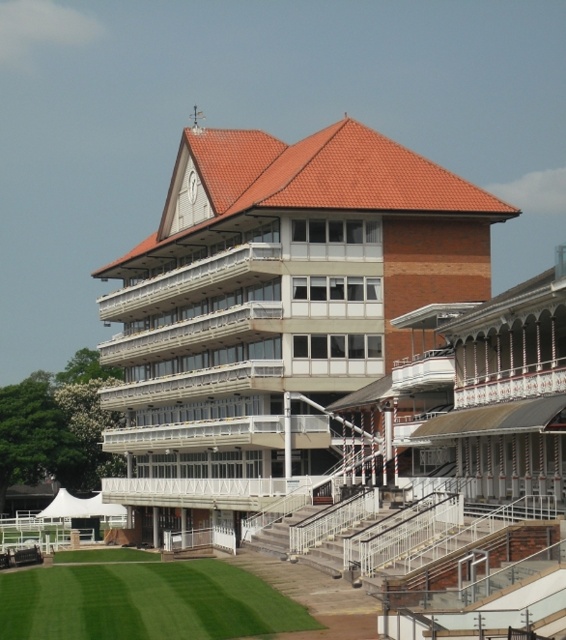
Question: Which object is closer to the camera taking this photo?

Choices:
 (A) brown brick building at center
 (B) green grass at lower left

Answer: (B)

Question: Which of the following is the farthest from the observer?

Choices:
 (A) brown brick building at center
 (B) green grass at lower left

Answer: (A)

Question: From the image, what is the correct spatial relationship of brown brick building at center in relation to green grass at lower left?

Choices:
 (A) above
 (B) below

Answer: (A)

Question: Is brown brick building at center thinner than green grass at lower left?

Choices:
 (A) yes
 (B) no

Answer: (B)

Question: Which point is closer to the camera taking this photo?

Choices:
 (A) (245, 611)
 (B) (310, 429)

Answer: (A)

Question: Does brown brick building at center have a smaller size compared to green grass at lower left?

Choices:
 (A) no
 (B) yes

Answer: (A)